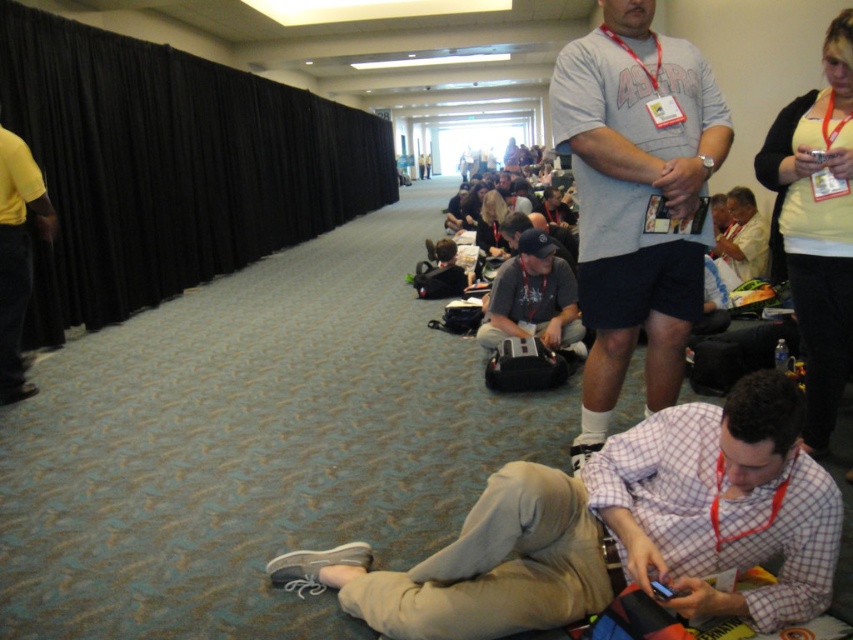
Question: Can you confirm if plaid shirt at lower center is positioned above gray cotton t-shirt at center?

Choices:
 (A) no
 (B) yes

Answer: (A)

Question: Which object appears closest to the camera in this image?

Choices:
 (A) plaid shirt at lower center
 (B) dark gray fabric cap at center

Answer: (A)

Question: Is plaid shirt at lower center thinner than dark gray fabric cap at center?

Choices:
 (A) no
 (B) yes

Answer: (A)

Question: Can you confirm if yellow t-shirt at left is thinner than dark gray fabric cap at center?

Choices:
 (A) no
 (B) yes

Answer: (B)

Question: Among these objects, which one is farthest from the camera?

Choices:
 (A) gray cotton t-shirt at center
 (B) plaid shirt at lower center

Answer: (A)

Question: Estimate the real-world distances between objects in this image. Which object is closer to the light beige shirt at center?

Choices:
 (A) gray cotton t-shirt at center
 (B) yellow t-shirt at left

Answer: (A)